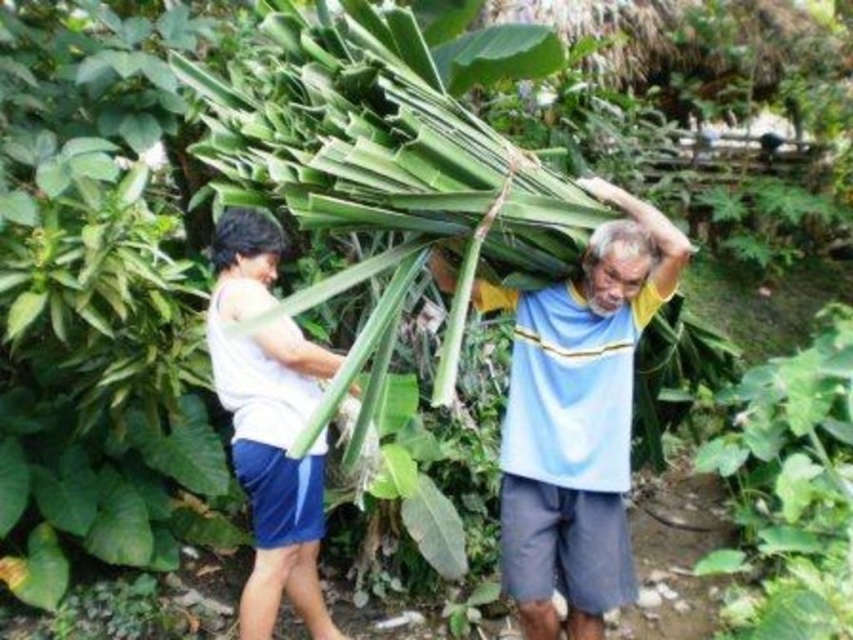
Who is positioned more to the right, light blue striped shirt at upper center or white matte tank top at left?

light blue striped shirt at upper center is more to the right.

Does light blue striped shirt at upper center have a lesser width compared to white matte tank top at left?

No, light blue striped shirt at upper center is not thinner than white matte tank top at left.

You are a GUI agent. You are given a task and a screenshot of the screen. Output one action in this format:
    pyautogui.click(x=<x>, y=<y>)
    Task: Click on the light blue striped shirt at upper center
    The height and width of the screenshot is (640, 853).
    Given the screenshot: What is the action you would take?
    pyautogui.click(x=577, y=417)